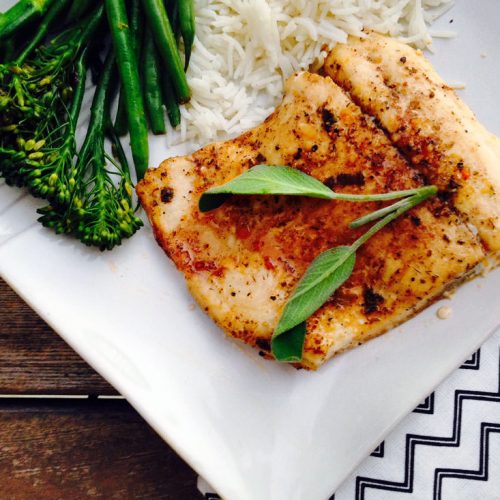
What are the coordinates of `brown wooden table` in the screenshot? It's located at [x=76, y=463].